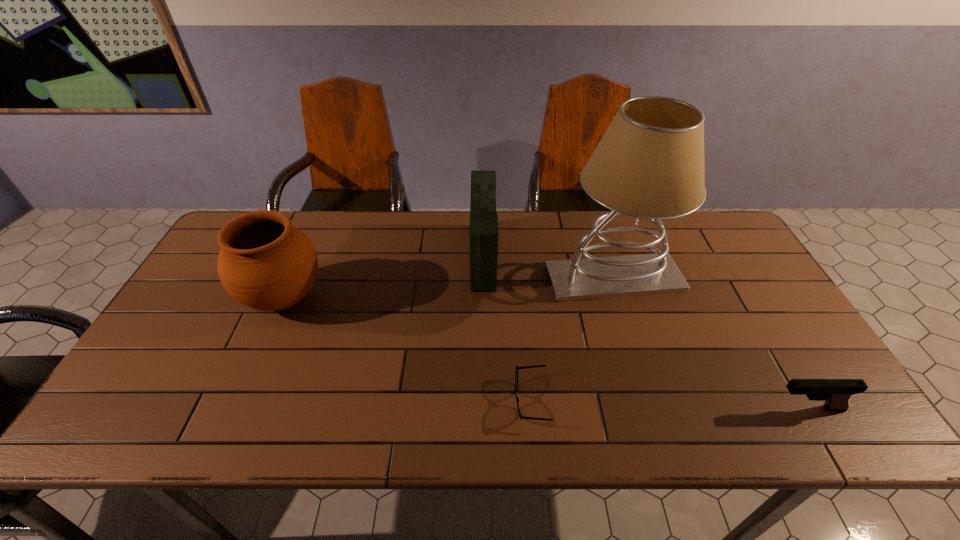
This screenshot has height=540, width=960. Identify the location of free space at the far right corner of the desktop. (684, 234).

Identify the location of vacant space at the near right corner of the desktop. The width and height of the screenshot is (960, 540). click(x=796, y=428).

Identify the location of free space between the leftmost object and the third object from left to right. (407, 349).

The width and height of the screenshot is (960, 540). In order to click on vacant area that lies between the leftmost object and the first-aid kit in this screenshot , I will do `click(384, 278)`.

The height and width of the screenshot is (540, 960). Find the location of `free space between the pottery and the first-aid kit`. free space between the pottery and the first-aid kit is located at coordinates (384, 278).

In order to click on free space between the pistol and the fourth object from left to right in this screenshot , I will do `click(710, 343)`.

Find the location of a particular element. The width and height of the screenshot is (960, 540). free space that is in between the shortest object and the fourth tallest object is located at coordinates (669, 405).

Locate an element on the screen. The width and height of the screenshot is (960, 540). empty location between the table lamp and the pottery is located at coordinates (449, 288).

Find the location of a particular element. free space between the pistol and the first-aid kit is located at coordinates (645, 333).

This screenshot has width=960, height=540. I want to click on free point between the first-aid kit and the fourth tallest object, so click(645, 333).